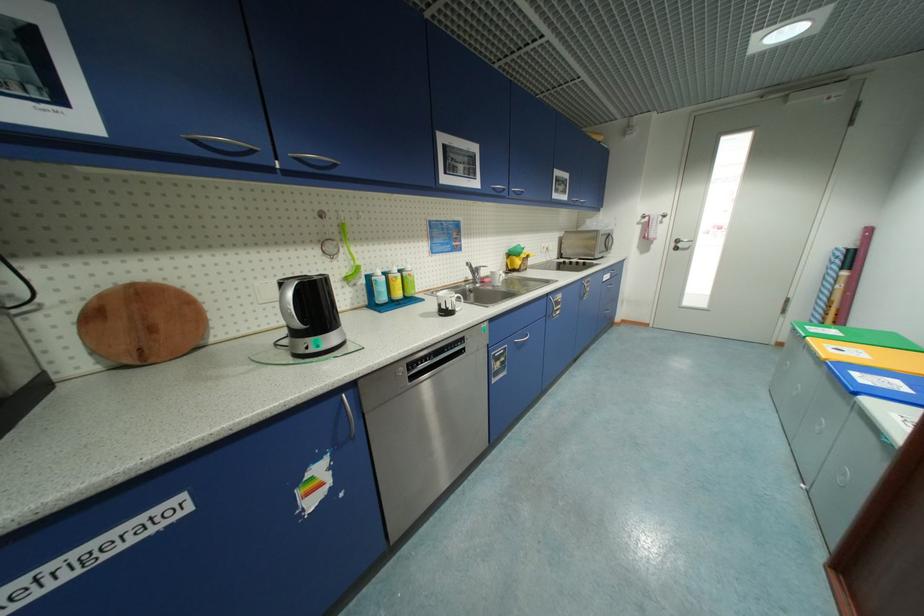
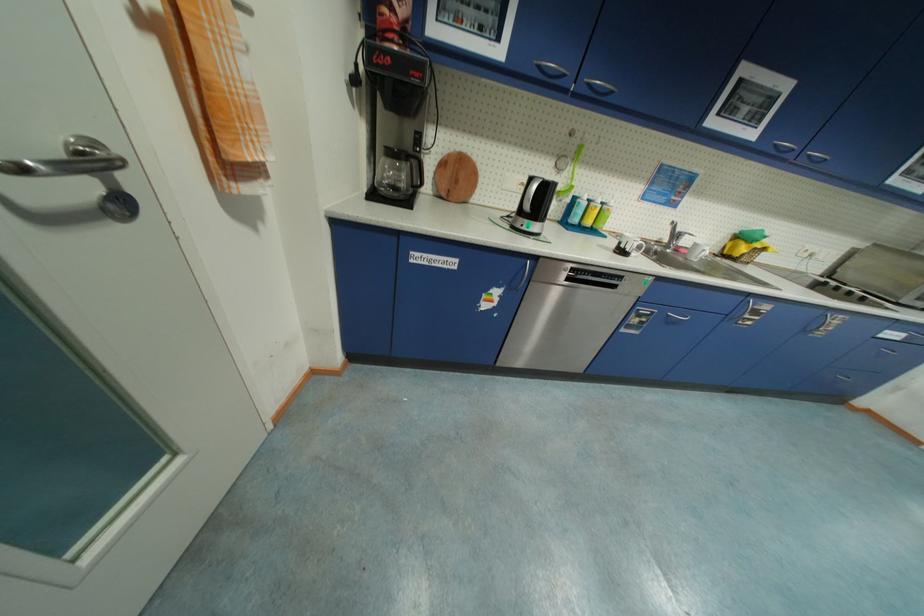
Locate, in the second image, the point that corresponds to (x=380, y=280) in the first image.

(584, 201)